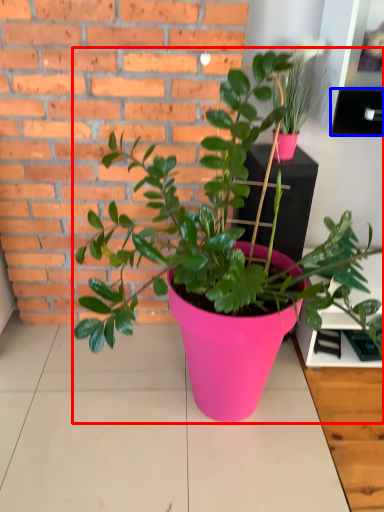
Question: Which object appears farthest to the camera in this image, houseplant (highlighted by a red box) or shelf (highlighted by a blue box)?

Choices:
 (A) houseplant
 (B) shelf

Answer: (B)